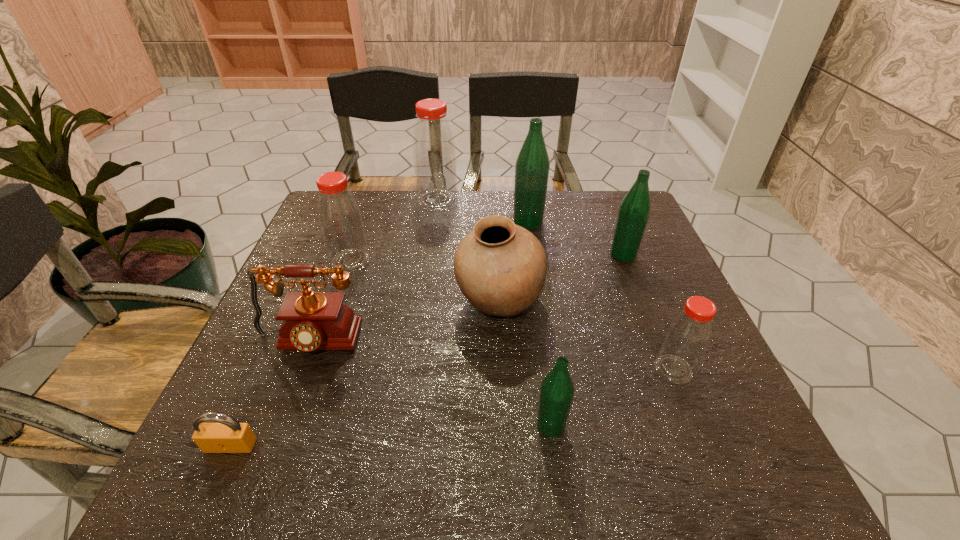
This screenshot has width=960, height=540. In order to click on the nearest red bottle in this screenshot , I will do `click(689, 333)`.

The width and height of the screenshot is (960, 540). Identify the location of the fifth farthest bottle. (689, 333).

This screenshot has width=960, height=540. Find the location of `the nearest bottle`. the nearest bottle is located at coordinates (557, 390).

The width and height of the screenshot is (960, 540). Find the location of `the nearest green bottle`. the nearest green bottle is located at coordinates (557, 390).

At what (x,y) coordinates should I click in order to perform the action: click on padlock. Please return your answer as a coordinate pair (x, y). Looking at the image, I should click on (227, 435).

Find the location of a particular element. vacant region located 0.060m on the front of the second red bottle from right to left is located at coordinates (435, 223).

Locate an element on the screen. Image resolution: width=960 pixels, height=540 pixels. free region located 0.220m on the left of the biggest green bottle is located at coordinates (436, 221).

Find the location of a particular element. The width and height of the screenshot is (960, 540). vacant space located on the back of the leftmost red bottle is located at coordinates pyautogui.click(x=371, y=205).

You are a GUI agent. You are given a task and a screenshot of the screen. Output one action in this format:
    pyautogui.click(x=<x>, y=<y>)
    Task: Click on the blank area located on the back of the second farthest green bottle
    
    Given the screenshot: What is the action you would take?
    pyautogui.click(x=611, y=223)

Where is `free region located on the left of the pottery`? Image resolution: width=960 pixels, height=540 pixels. free region located on the left of the pottery is located at coordinates (284, 302).